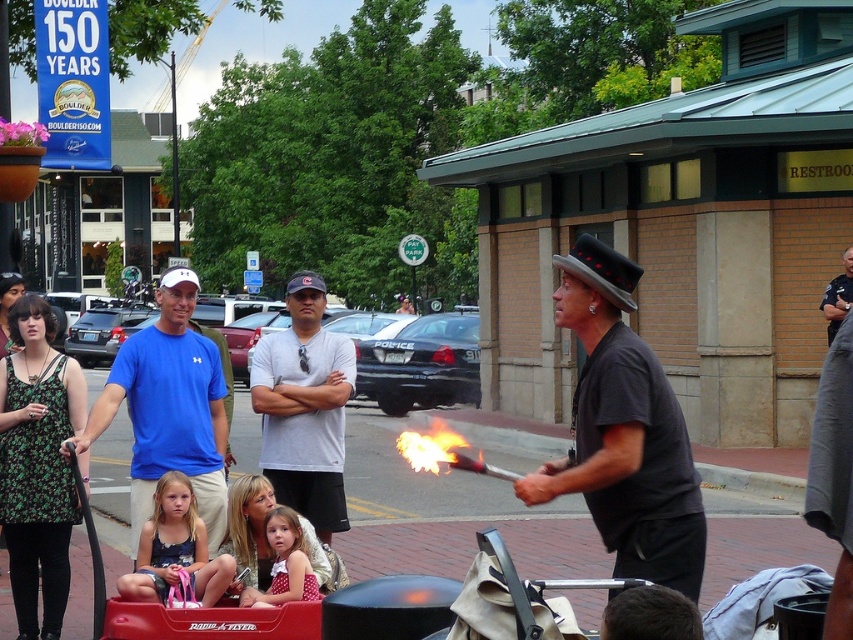
Question: Which point is farther to the camera?

Choices:
 (A) (262, 465)
 (B) (131, 397)
 (C) (454, 451)
 (D) (289, 557)

Answer: (A)

Question: Considering the relative positions of white matte shirt at center and dotted pink dress at center in the image provided, where is white matte shirt at center located with respect to dotted pink dress at center?

Choices:
 (A) above
 (B) below

Answer: (A)

Question: Considering the real-world distances, which object is closest to the black matte hat at center?

Choices:
 (A) dotted pink dress at center
 (B) blue cotton shirt at center
 (C) matte blue dress at center

Answer: (A)

Question: Does black matte hat at center come in front of white matte shirt at center?

Choices:
 (A) yes
 (B) no

Answer: (A)

Question: Which point is farther to the camera?

Choices:
 (A) (264, 355)
 (B) (167, 593)

Answer: (A)

Question: Is blue cotton shirt at center in front of matte blue dress at center?

Choices:
 (A) yes
 (B) no

Answer: (B)